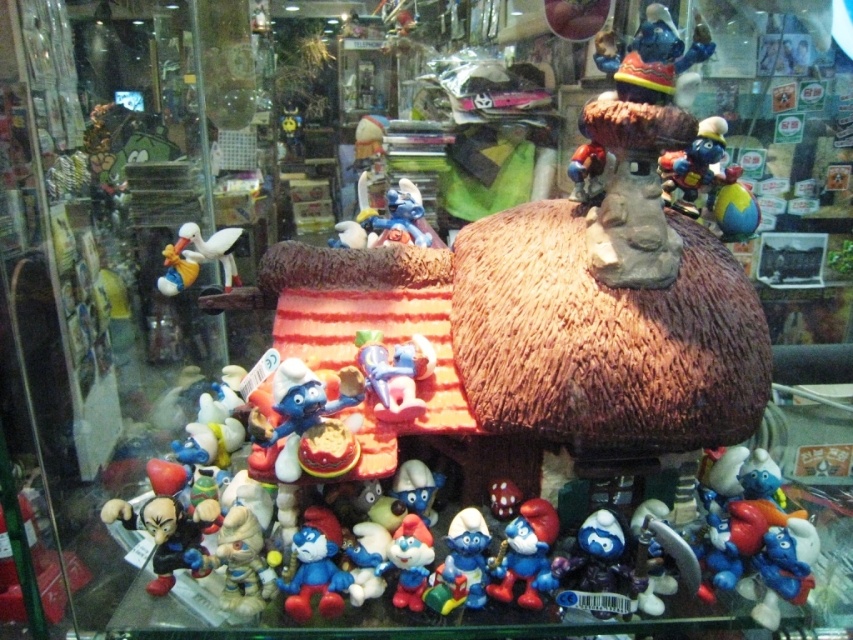
You are a collector who wants to place a new figurine between the blue glossy figurine at center and the shiny metallic figurine at upper right. The new figurine must be exactly halfway in size between the two existing ones. What should be the size of the new figurine?

The blue glossy figurine at center has a smaller size compared to shiny metallic figurine at upper right. To find the halfway size between them, you would take the average of their sizes. If the blue glossy figurine at center is smaller, the new figurine should be sized midway between the two existing sizes.

You are a photographer aiming to capture a closeup of the mushroom house in the scene. You have two options for your camera focus points. One is at point (294, 598) and the other is at point (535, 602). Which point should you choose to ensure the mushroom house is in sharp focus?

Point (294, 598) is closer to the camera than point (535, 602), so you should choose point (294, 598) to ensure the mushroom house is in sharp focus.

You are a collector who wants to place a new Smurf figurine on the display. You have a small shelf that can only hold items up to 10 cm in width. You see the blue matte smurf at center and the matte blue plastic smurf at lower center. Which of these two Smurf figurines is more likely to fit on the shelf?

The matte blue plastic smurf at lower center is more likely to fit on the shelf since it might be narrower than the blue matte smurf at center, which could exceed the 10 cm width limit.